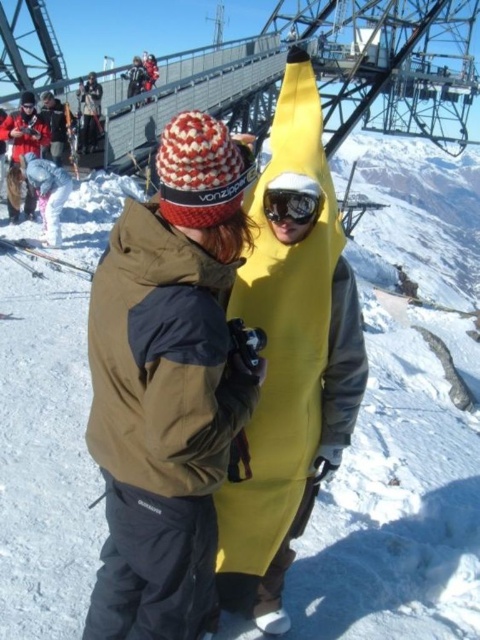
What is located at the coordinates point [41,253] in the image?

The point [41,253] corresponds to the metallic silver ski at center.

You are organizing a winter festival and need to arrange the yellow matte banana at center and the metallic silver ski at center on a display table. The table is only wide enough to accommodate one of them. Based on their widths, which object should you choose to fit on the table?

The yellow matte banana at center might be wider than metallic silver ski at center, so it is possible that the metallic silver ski at center would fit better on the table if the table can only accommodate one of them.